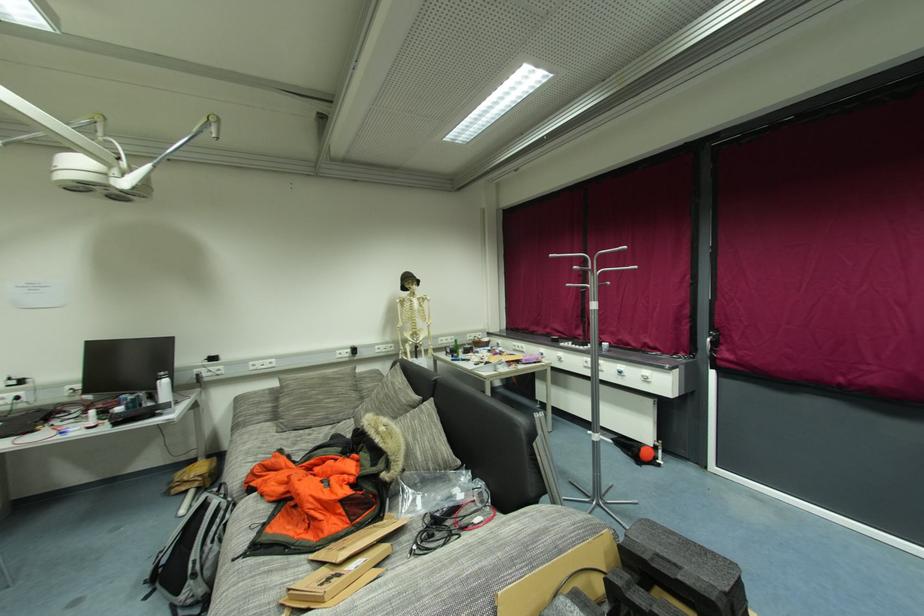
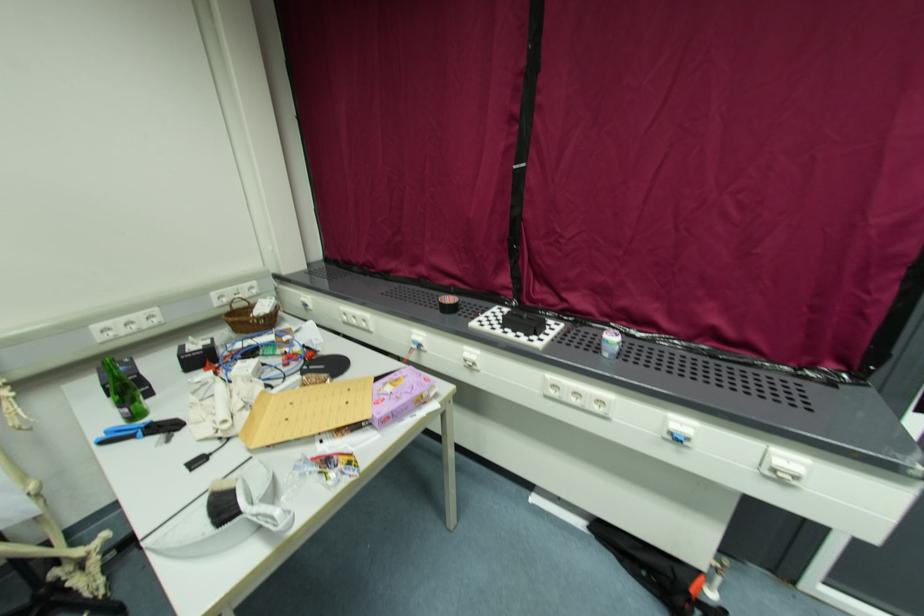
The point at (564, 354) is marked in the first image. Where is the corresponding point in the second image?

(476, 352)